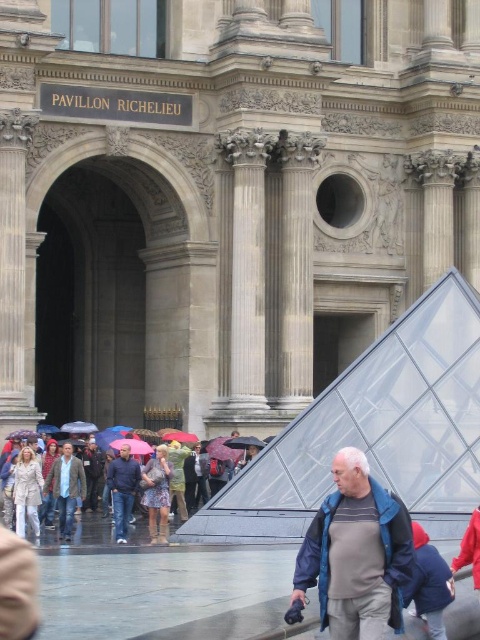
Is point (163, 483) closer to camera compared to point (31, 516)?

No.

Can you confirm if floral dress at center is shorter than beige textured coat at lower left?

Indeed, floral dress at center has a lesser height compared to beige textured coat at lower left.

Measure the distance between point (154,541) and camera.

A distance of 175.23 feet exists between point (154,541) and camera.

Find the location of a particular element. Image resolution: width=480 pixels, height=640 pixels. floral dress at center is located at coordinates click(156, 493).

Who is more forward, (342, 509) or (280, 305)?

Point (342, 509) is in front.

Is gray fabric jacket at lower right taller than smooth stone column at center?

No.

Does point (337, 467) come in front of point (296, 291)?

Yes, point (337, 467) is in front of point (296, 291).

Locate an element on the screen. gray fabric jacket at lower right is located at coordinates (356, 554).

Does point (348, 621) lie in front of point (153, 497)?

Yes, point (348, 621) is closer to viewer.

Which of these two, gray fabric jacket at lower right or floral dress at center, stands taller?

floral dress at center

Who is more distant from viewer, (343,632) or (154,515)?

Point (154,515)

At what (x,y) coordinates should I click in order to perform the action: click on gray fabric jacket at lower right. Please return your answer as a coordinate pair (x, y). Looking at the image, I should click on (356, 554).